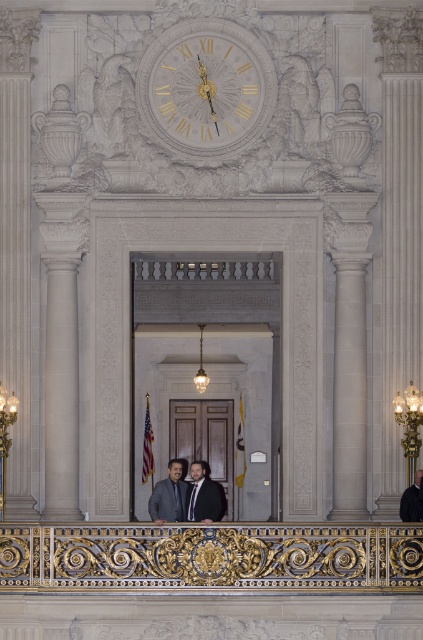
Question: Based on their relative distances, which object is farther from the gold ornate balustrade at center?

Choices:
 (A) gold metallic clock at upper center
 (B) matte black suit at center
 (C) dark gray suit at center

Answer: (A)

Question: Which point is closer to the camera taking this photo?

Choices:
 (A) (209, 502)
 (B) (419, 509)
 (C) (219, 504)

Answer: (B)

Question: Does gold metallic clock at upper center appear on the right side of dark gray matte business suit at center?

Choices:
 (A) yes
 (B) no

Answer: (A)

Question: Is matte black suit at center below dark gray suit at lower right?

Choices:
 (A) no
 (B) yes

Answer: (A)

Question: Estimate the real-world distances between objects in this image. Which object is farther from the gold metallic clock at upper center?

Choices:
 (A) gold ornate balustrade at center
 (B) dark gray suit at center

Answer: (A)

Question: Can you confirm if matte black suit at center is smaller than dark gray matte business suit at center?

Choices:
 (A) yes
 (B) no

Answer: (B)